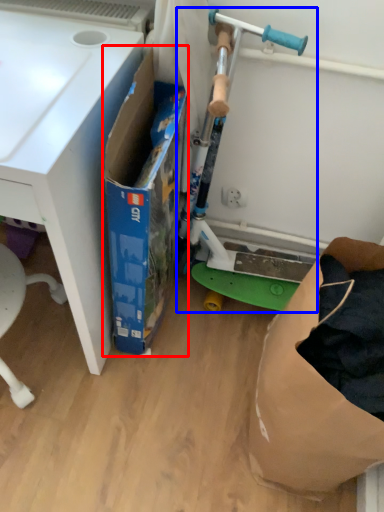
Question: Which object is closer to the camera taking this photo, box (highlighted by a red box) or appliance (highlighted by a blue box)?

Choices:
 (A) box
 (B) appliance

Answer: (A)